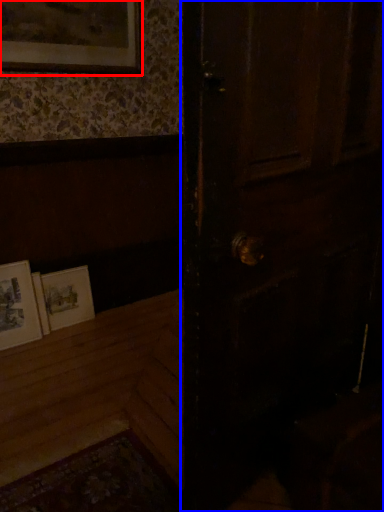
Question: Among these objects, which one is farthest to the camera, picture frame (highlighted by a red box) or door (highlighted by a blue box)?

Choices:
 (A) picture frame
 (B) door

Answer: (A)